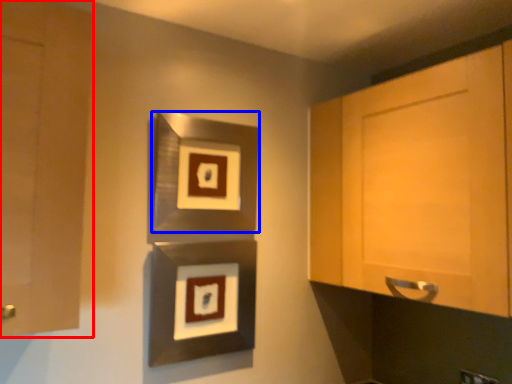
Question: Which object is closer to the camera taking this photo, cabinetry (highlighted by a red box) or picture frame (highlighted by a blue box)?

Choices:
 (A) cabinetry
 (B) picture frame

Answer: (A)